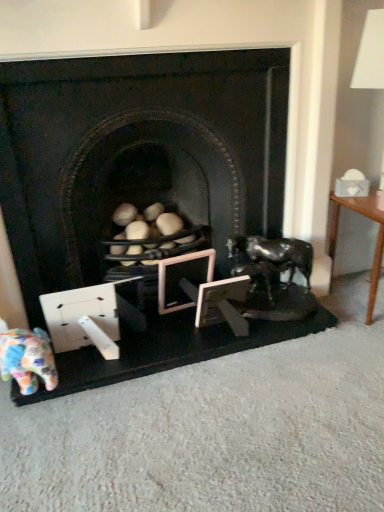
The height and width of the screenshot is (512, 384). What are the coordinates of `vacant space positioned to the left of wooden picture frame at center, arranged as the first picture frame when viewed from the right` in the screenshot? It's located at (173, 338).